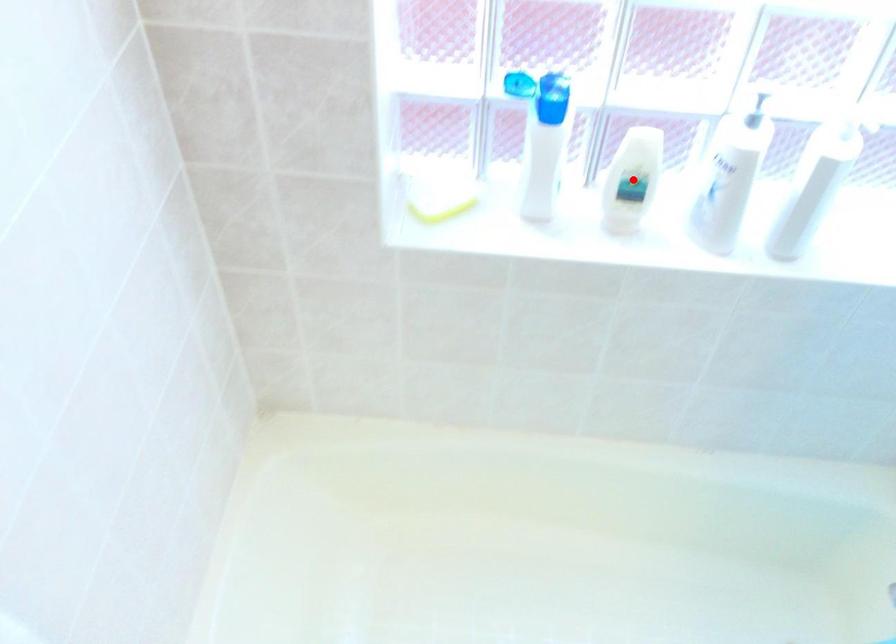
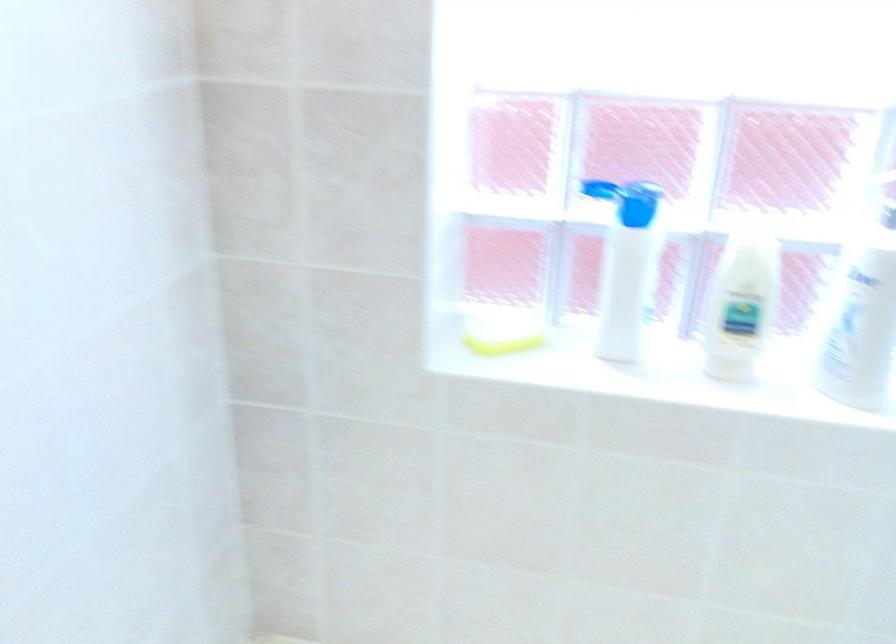
Question: I am providing you with two images of the same scene from different viewpoints. A red point is marked on the first image. At the location where the point appears in image 1, is it still visible in image 2?

Choices:
 (A) Yes
 (B) No

Answer: (A)